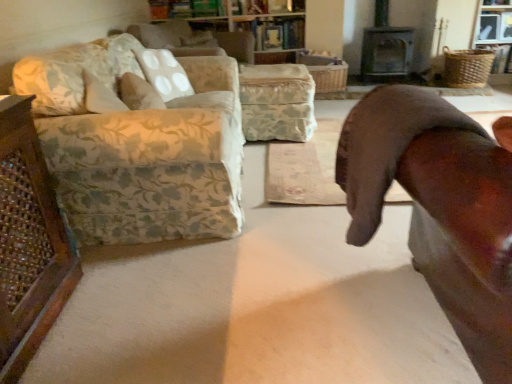
The height and width of the screenshot is (384, 512). I want to click on free space in front of floral fabric couch at left, so click(210, 300).